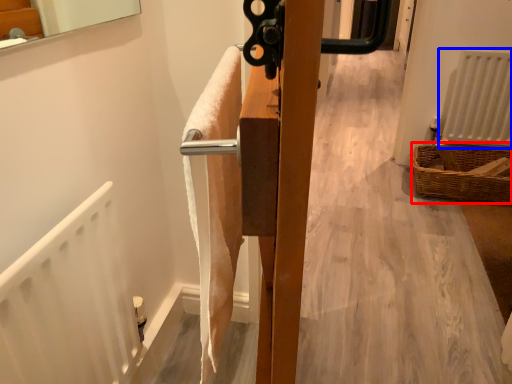
Question: Which of the following is the farthest to the observer, basket (highlighted by a red box) or radiator (highlighted by a blue box)?

Choices:
 (A) basket
 (B) radiator

Answer: (B)